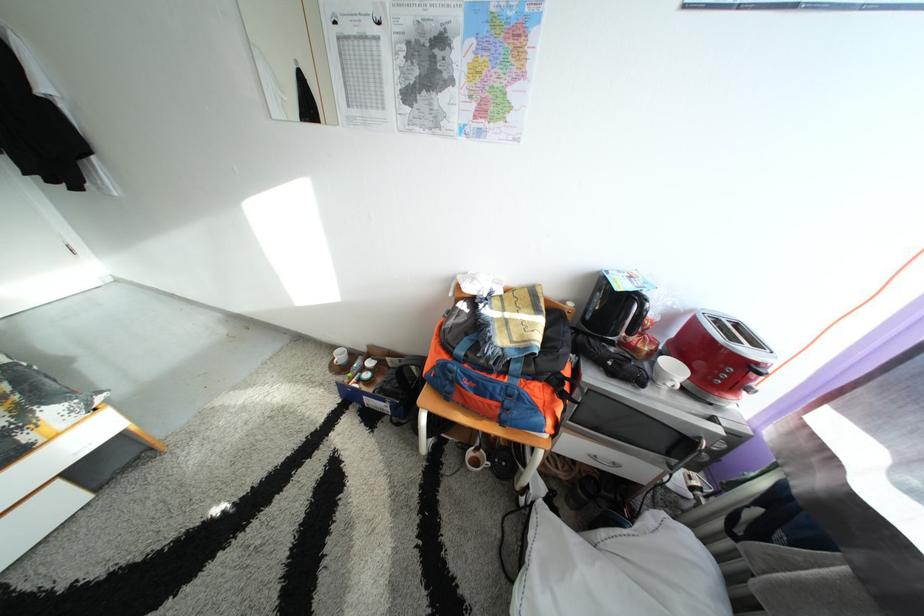
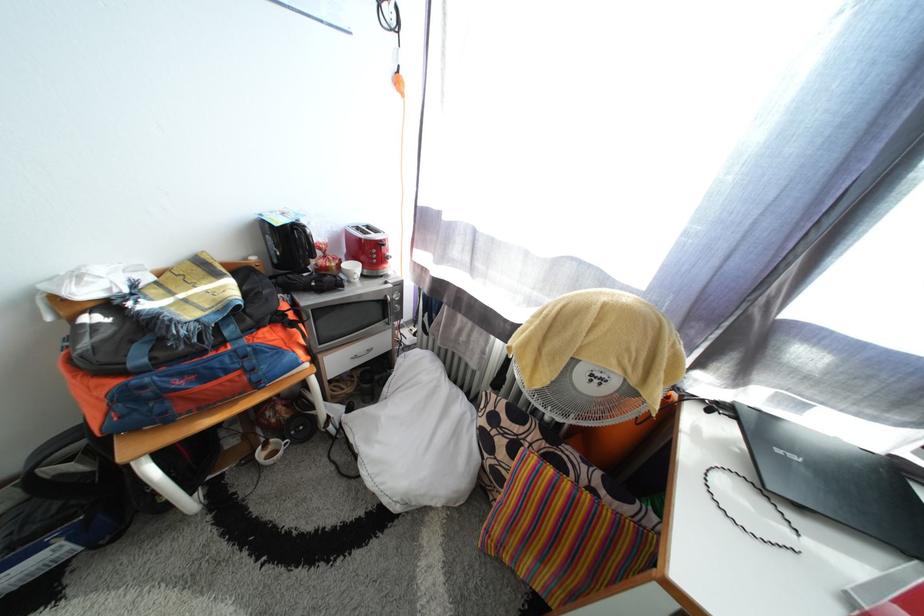
In the second image, find the point that corresponds to point 698,440 in the first image.

(390, 304)